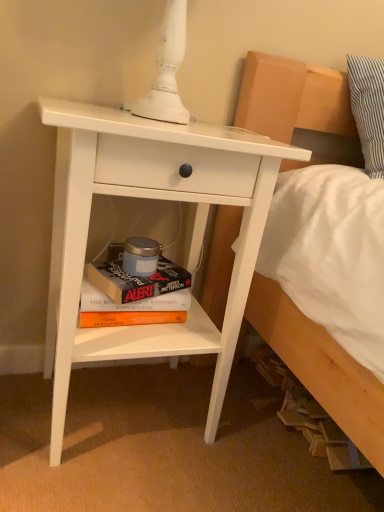
Where is `vacant area that is situated to the right of white matte nightstand at center-left`? vacant area that is situated to the right of white matte nightstand at center-left is located at coordinates (259, 441).